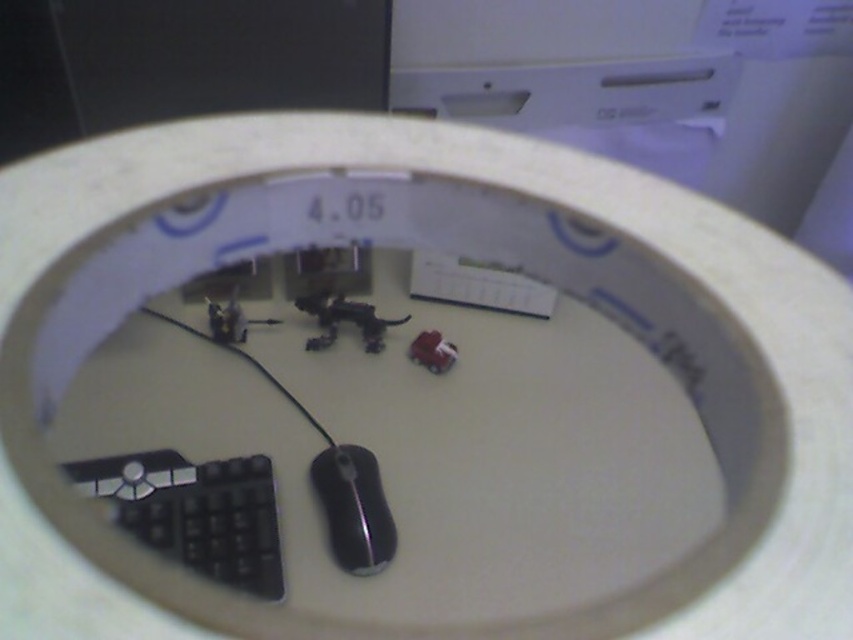
Between metallic plastic toy at center and matte plastic toy car at center, which one is positioned lower?

matte plastic toy car at center is below.

Which is more to the right, metallic plastic toy at center or matte plastic toy car at center?

matte plastic toy car at center

This screenshot has width=853, height=640. Find the location of `metallic plastic toy at center`. metallic plastic toy at center is located at coordinates (344, 320).

Describe the element at coordinates (354, 508) in the screenshot. I see `black glossy mouse at center` at that location.

Between black glossy mouse at center and metallic plastic toy at center, which one appears on the right side from the viewer's perspective?

Positioned to the right is black glossy mouse at center.

Is point (370, 456) positioned before point (374, 332)?

Yes, point (370, 456) is closer to viewer.

Image resolution: width=853 pixels, height=640 pixels. In order to click on black glossy mouse at center in this screenshot , I will do `click(354, 508)`.

Does point (194, 509) lie behind point (389, 529)?

Yes, it is.

Which is in front, point (204, 480) or point (344, 516)?

Point (344, 516) is more forward.

Locate an element on the screen. The image size is (853, 640). black matte keyboard at lower left is located at coordinates (195, 513).